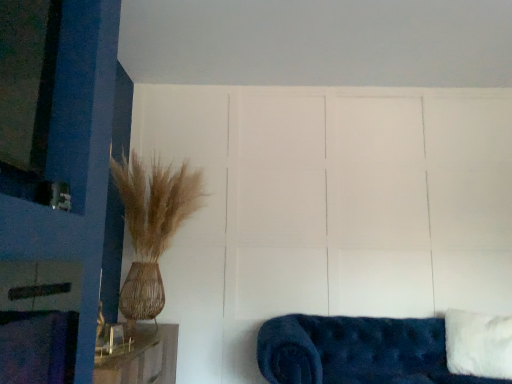
Question: Based on their positions, is white fluffy pillow at lower right located to the left or right of velvet blue couch at lower right?

Choices:
 (A) left
 (B) right

Answer: (B)

Question: From a real-world perspective, relative to velvet blue couch at lower right, is white fluffy pillow at lower right vertically above or below?

Choices:
 (A) below
 (B) above

Answer: (B)

Question: Considering their positions, is white fluffy pillow at lower right located in front of or behind velvet blue couch at lower right?

Choices:
 (A) behind
 (B) front

Answer: (A)

Question: From a real-world perspective, is velvet blue couch at lower right positioned above or below white fluffy pillow at lower right?

Choices:
 (A) above
 (B) below

Answer: (B)

Question: In terms of size, does velvet blue couch at lower right appear bigger or smaller than white fluffy pillow at lower right?

Choices:
 (A) big
 (B) small

Answer: (A)

Question: Does point (441, 349) appear closer or farther from the camera than point (505, 364)?

Choices:
 (A) closer
 (B) farther

Answer: (B)

Question: In the image, is velvet blue couch at lower right positioned in front of or behind white fluffy pillow at lower right?

Choices:
 (A) behind
 (B) front

Answer: (B)